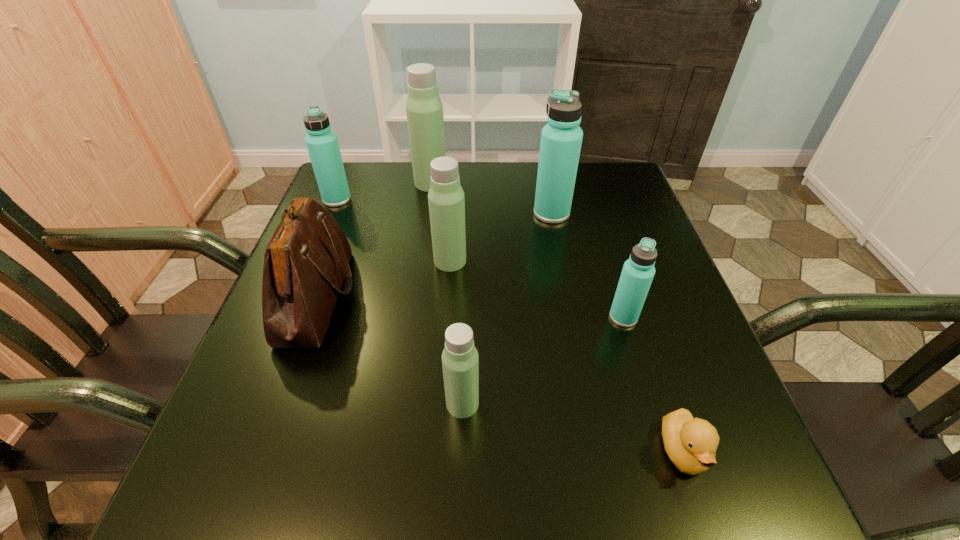
Where is `aqua thermos bottle that stands as the second closest to the second smallest aqua thermos bottle`? aqua thermos bottle that stands as the second closest to the second smallest aqua thermos bottle is located at coordinates (638, 271).

Where is `free point that satisfies the following two spatial constraints: 1. on the back side of the biggest aqua thermos bottle; 2. on the right side of the seventh farthest object`? free point that satisfies the following two spatial constraints: 1. on the back side of the biggest aqua thermos bottle; 2. on the right side of the seventh farthest object is located at coordinates (468, 213).

Identify the location of vacant area in the image that satisfies the following two spatial constraints: 1. on the front side of the biggest light thermos bottle; 2. on the left side of the rightmost thermos bottle. The height and width of the screenshot is (540, 960). (411, 317).